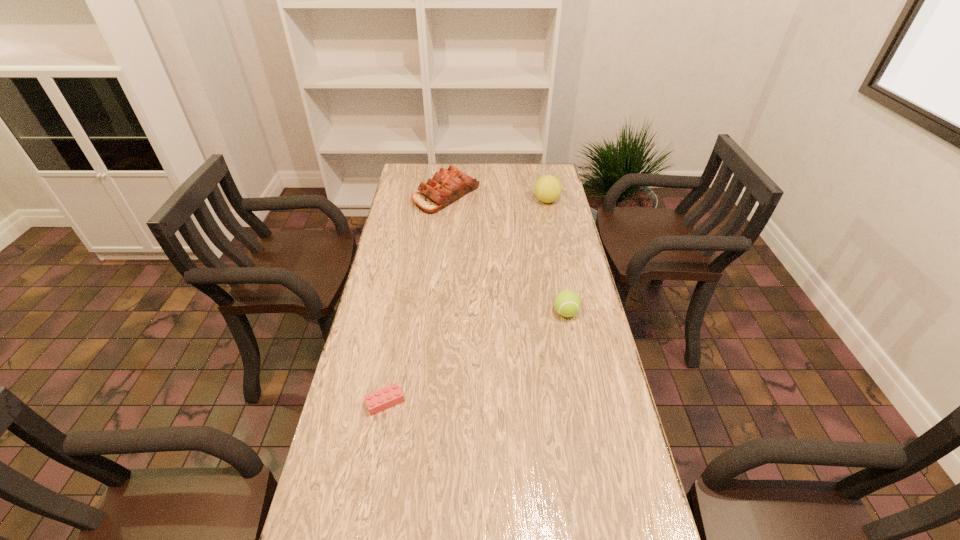
Locate an element on the screen. This screenshot has width=960, height=540. free space that satisfies the following two spatial constraints: 1. on the back side of the farther tennis ball; 2. on the left side of the shortest object is located at coordinates (421, 201).

Image resolution: width=960 pixels, height=540 pixels. What are the coordinates of `vacant position in the image that satisfies the following two spatial constraints: 1. on the back side of the nearest object; 2. on the left side of the nearer tennis ball` in the screenshot? It's located at (401, 313).

Find the location of a particular element. This screenshot has width=960, height=540. blank space that satisfies the following two spatial constraints: 1. on the back side of the nearer tennis ball; 2. on the right side of the Lego is located at coordinates (401, 313).